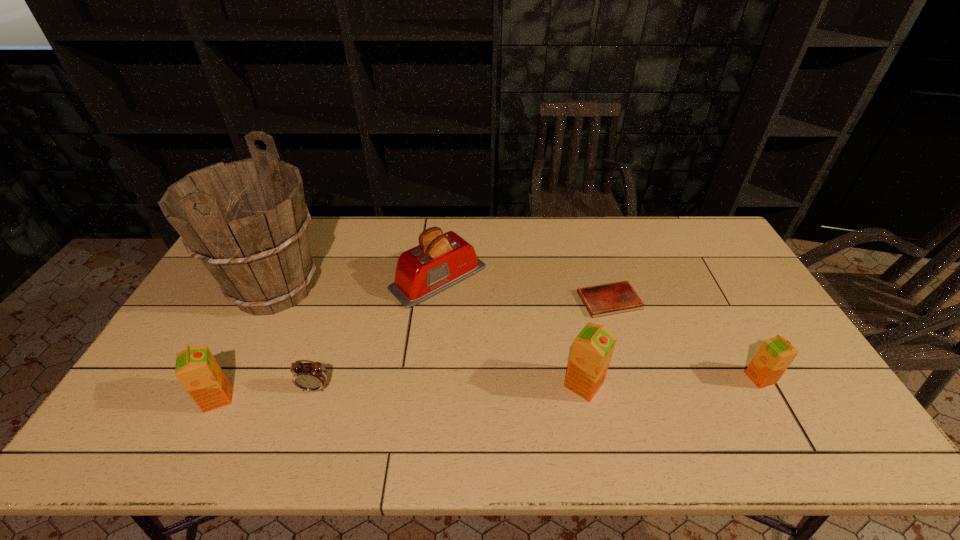
This screenshot has height=540, width=960. I want to click on object located at the right edge, so click(775, 355).

I want to click on object that is positioned at the far left corner, so click(247, 221).

Locate an element on the screen. The image size is (960, 540). object positioned at the near right corner is located at coordinates (775, 355).

Where is `vacant space at the far edge`? Image resolution: width=960 pixels, height=540 pixels. vacant space at the far edge is located at coordinates (462, 232).

Identify the location of free space at the near edge of the desktop. click(370, 403).

This screenshot has height=540, width=960. In the image, there is a desktop. In order to click on vacant region at the left edge in this screenshot , I will do `click(234, 330)`.

The image size is (960, 540). I want to click on vacant space at the far right corner, so click(691, 253).

The image size is (960, 540). In the image, there is a desktop. What are the coordinates of `free region at the near right corner` in the screenshot? It's located at (822, 387).

This screenshot has height=540, width=960. Identify the location of blank region between the fourth object from left to right and the diary. (524, 289).

This screenshot has width=960, height=540. What are the coordinates of `free area in between the fifth tallest object and the second orange juice from right to left` in the screenshot? It's located at (672, 381).